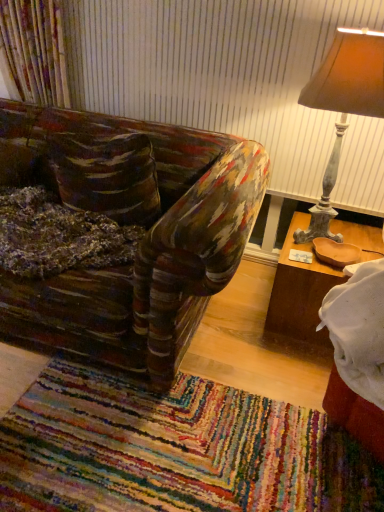
The image size is (384, 512). Find the location of `wooden tray at right`. wooden tray at right is located at coordinates (300, 291).

The height and width of the screenshot is (512, 384). Describe the element at coordinates (300, 291) in the screenshot. I see `wooden tray at right` at that location.

I want to click on matte brown lampshade at upper right, so click(x=343, y=106).

Measure the distance between point (312, 230) and camera.

A distance of 1.99 meters exists between point (312, 230) and camera.

This screenshot has width=384, height=512. What do you see at coordinates (343, 106) in the screenshot?
I see `matte brown lampshade at upper right` at bounding box center [343, 106].

You are a GUI agent. You are given a task and a screenshot of the screen. Output one action in this format:
    pyautogui.click(x=<x>, y=<y>)
    Task: Click on the wooden tray at right
    The image size is (384, 512).
    Given the screenshot: What is the action you would take?
    pyautogui.click(x=300, y=291)

Considering the positions of objects matte brown lampshade at upper right and wooden tray at right in the image provided, who is more to the left, matte brown lampshade at upper right or wooden tray at right?

matte brown lampshade at upper right is more to the left.

Based on the photo, is matte brown lampshade at upper right positioned before wooden tray at right?

That is True.

Which is behind, point (378, 51) or point (303, 303)?

The point (303, 303) is farther.

From the image's perspective, relative to wooden tray at right, is matte brown lampshade at upper right above or below?

Based on their image positions, matte brown lampshade at upper right is located above wooden tray at right.

From a real-world perspective, is matte brown lampshade at upper right above or below wooden tray at right?

In terms of real-world spatial position, matte brown lampshade at upper right is above wooden tray at right.

Does matte brown lampshade at upper right have a lesser width compared to wooden tray at right?

Yes, matte brown lampshade at upper right is thinner than wooden tray at right.

Considering the relative sizes of matte brown lampshade at upper right and wooden tray at right in the image provided, is matte brown lampshade at upper right shorter than wooden tray at right?

No, matte brown lampshade at upper right is not shorter than wooden tray at right.

Can you confirm if matte brown lampshade at upper right is bigger than wooden tray at right?

Yes.

Is matte brown lampshade at upper right inside the boundaries of wooden tray at right, or outside?

The correct answer is: outside.

Would you say matte brown lampshade at upper right is a long distance from wooden tray at right?

Actually, matte brown lampshade at upper right and wooden tray at right are a little close together.

Is matte brown lampshade at upper right oriented towards wooden tray at right?

No, matte brown lampshade at upper right is not turned towards wooden tray at right.

Locate an element on the screen. This screenshot has height=512, width=384. lamp located in front of the wooden tray at right is located at coordinates (343, 106).

Does wooden tray at right appear on the right side of matte brown lampshade at upper right?

Correct, you'll find wooden tray at right to the right of matte brown lampshade at upper right.

Relative to matte brown lampshade at upper right, is wooden tray at right in front or behind?

wooden tray at right is positioned farther from the viewer than matte brown lampshade at upper right.

Considering the positions of point (322, 267) and point (350, 47), is point (322, 267) closer or farther from the camera than point (350, 47)?

Point (322, 267) appears to be farther away from the viewer than point (350, 47).

From the image's perspective, who appears lower, wooden tray at right or matte brown lampshade at upper right?

From the image's view, wooden tray at right is below.

Looking at this image, from a real-world perspective, is wooden tray at right physically located above or below matte brown lampshade at upper right?

wooden tray at right is situated lower than matte brown lampshade at upper right in the real world.

Considering the relative sizes of wooden tray at right and matte brown lampshade at upper right in the image provided, is wooden tray at right thinner than matte brown lampshade at upper right?

No, wooden tray at right is not thinner than matte brown lampshade at upper right.

Can you confirm if wooden tray at right is taller than matte brown lampshade at upper right?

In fact, wooden tray at right may be shorter than matte brown lampshade at upper right.

Considering the relative sizes of wooden tray at right and matte brown lampshade at upper right in the image provided, is wooden tray at right bigger than matte brown lampshade at upper right?

Incorrect, wooden tray at right is not larger than matte brown lampshade at upper right.

Is wooden tray at right outside of matte brown lampshade at upper right?

Yes, wooden tray at right is not within matte brown lampshade at upper right.

Are wooden tray at right and matte brown lampshade at upper right far apart?

No, there isn't a large distance between wooden tray at right and matte brown lampshade at upper right.

Is wooden tray at right oriented away from matte brown lampshade at upper right?

No, wooden tray at right is not facing away from matte brown lampshade at upper right.

What's the angular difference between wooden tray at right and matte brown lampshade at upper right's facing directions?

They differ by 0.000556 degrees in their facing directions.

I want to click on lamp on the left of wooden tray at right, so click(x=343, y=106).

Find the location of `lamp above the wooden tray at right (from the image's perspective)`. lamp above the wooden tray at right (from the image's perspective) is located at coordinates tap(343, 106).

Find the location of `table behind the matte brown lampshade at upper right`. table behind the matte brown lampshade at upper right is located at coordinates (300, 291).